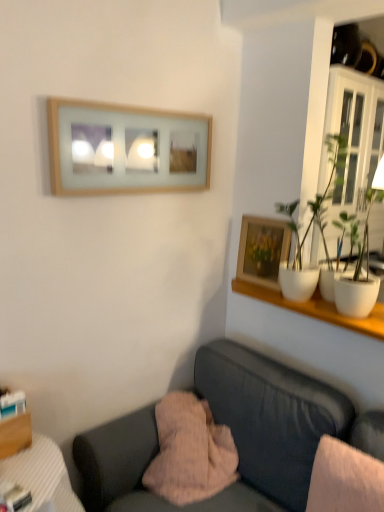
Question: Should I look upward or downward to see white glossy cabinet at upper right?

Choices:
 (A) up
 (B) down

Answer: (A)

Question: From the image's perspective, would you say wooden picture frame at upper right, the first picture frame positioned from the bottom, is shown under white glossy cabinet at upper right?

Choices:
 (A) yes
 (B) no

Answer: (A)

Question: Does wooden picture frame at upper right, the first picture frame positioned from the bottom, have a lesser height compared to white glossy cabinet at upper right?

Choices:
 (A) no
 (B) yes

Answer: (B)

Question: Are wooden picture frame at upper right, marked as the second picture frame in a left-to-right arrangement, and white glossy cabinet at upper right located far from each other?

Choices:
 (A) yes
 (B) no

Answer: (B)

Question: Is wooden picture frame at upper right, the first picture frame in the right-to-left sequence, to the left of white glossy cabinet at upper right from the viewer's perspective?

Choices:
 (A) no
 (B) yes

Answer: (B)

Question: Is white glossy cabinet at upper right a part of wooden picture frame at upper right, the first picture frame positioned from the bottom?

Choices:
 (A) yes
 (B) no

Answer: (B)

Question: From a real-world perspective, is wooden picture frame at upper right, the first picture frame positioned from the bottom, physically below white glossy cabinet at upper right?

Choices:
 (A) yes
 (B) no

Answer: (A)

Question: Is pink fuzzy pillow at lower center shorter than velvet dark gray couch at lower center?

Choices:
 (A) no
 (B) yes

Answer: (B)

Question: Is pink fuzzy pillow at lower center touching velvet dark gray couch at lower center?

Choices:
 (A) yes
 (B) no

Answer: (B)

Question: Is pink fuzzy pillow at lower center completely or partially outside of velvet dark gray couch at lower center?

Choices:
 (A) no
 (B) yes

Answer: (A)

Question: From a real-world perspective, does pink fuzzy pillow at lower center sit lower than velvet dark gray couch at lower center?

Choices:
 (A) yes
 (B) no

Answer: (B)

Question: Considering the relative sizes of pink fuzzy pillow at lower center and velvet dark gray couch at lower center in the image provided, is pink fuzzy pillow at lower center thinner than velvet dark gray couch at lower center?

Choices:
 (A) yes
 (B) no

Answer: (A)

Question: Is pink fuzzy pillow at lower center looking in the opposite direction of velvet dark gray couch at lower center?

Choices:
 (A) yes
 (B) no

Answer: (A)

Question: Can you confirm if velvet dark gray couch at lower center is thinner than white glossy pot at upper right?

Choices:
 (A) yes
 (B) no

Answer: (B)